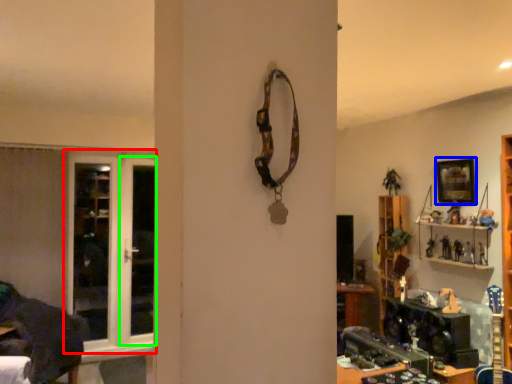
Question: Estimate the real-world distances between objects in this image. Which object is farther from door (highlighted by a red box), picture frame (highlighted by a blue box) or screen door (highlighted by a green box)?

Choices:
 (A) picture frame
 (B) screen door

Answer: (A)